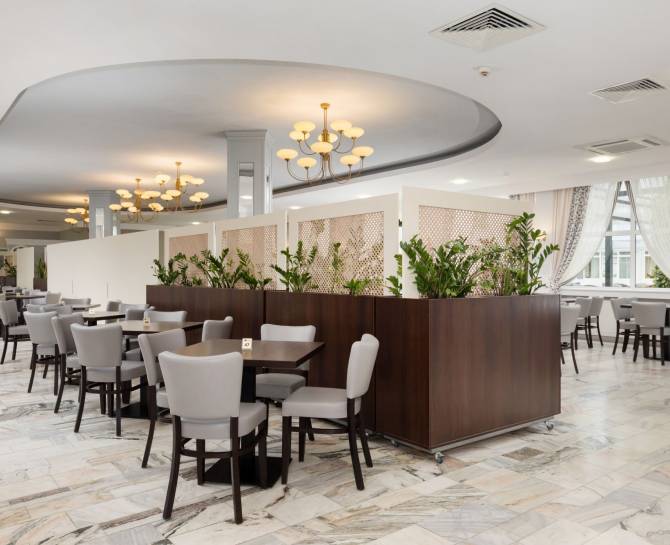
At what (x,y) coordinates should I click in order to perform the action: click on table. Please return your answer as a coordinate pair (x, y). The image size is (670, 545). Looking at the image, I should click on (264, 351), (159, 327), (103, 317), (84, 307), (25, 295), (628, 304), (570, 299).